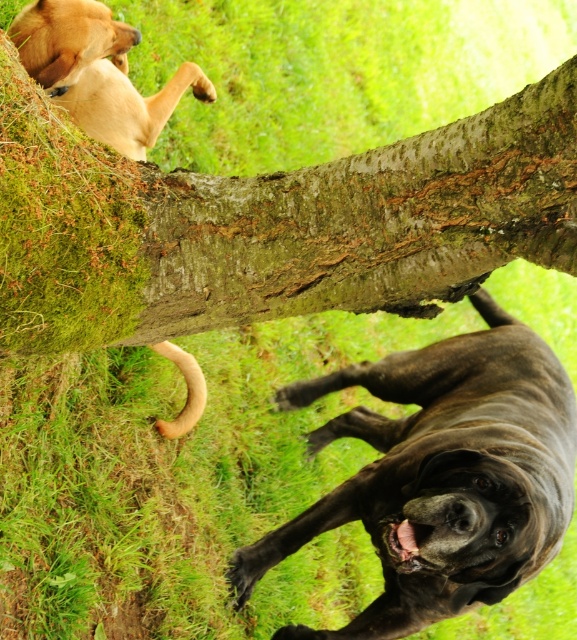
Question: Can you confirm if green mossy bark at upper center is thinner than shiny brown dog at upper center?

Choices:
 (A) yes
 (B) no

Answer: (A)

Question: Which object appears closest to the camera in this image?

Choices:
 (A) golden fur dog at upper left
 (B) green mossy bark at upper center
 (C) shiny brown dog at upper center

Answer: (B)

Question: Is green mossy bark at upper center positioned before shiny brown dog at upper center?

Choices:
 (A) yes
 (B) no

Answer: (A)

Question: Which of the following is the farthest from the observer?

Choices:
 (A) (21, 56)
 (B) (63, 208)

Answer: (A)

Question: Can you confirm if green mossy bark at upper center is wider than golden fur dog at upper left?

Choices:
 (A) no
 (B) yes

Answer: (B)

Question: Which point is farther to the camera?

Choices:
 (A) (429, 618)
 (B) (575, 221)
 (C) (91, 4)

Answer: (A)